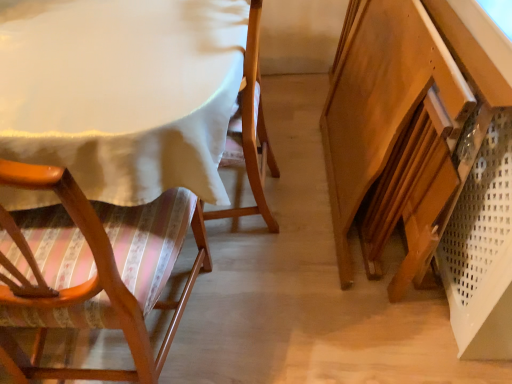
Image resolution: width=512 pixels, height=384 pixels. Describe the element at coordinates (91, 270) in the screenshot. I see `wooden chair with striped cushion at left` at that location.

Where is `white fabric table at upper left`? The width and height of the screenshot is (512, 384). white fabric table at upper left is located at coordinates (123, 93).

Considering the relative sizes of wooden vanity at lower right and wooden chair with striped cushion at left in the image provided, is wooden vanity at lower right thinner than wooden chair with striped cushion at left?

Yes.

Can you confirm if wooden vanity at lower right is bigger than wooden chair with striped cushion at left?

Incorrect, wooden vanity at lower right is not larger than wooden chair with striped cushion at left.

Is wooden vanity at lower right positioned with its back to wooden chair with striped cushion at left?

That's not correct — wooden vanity at lower right is not looking away from wooden chair with striped cushion at left.

How distant is wooden vanity at lower right from wooden chair with striped cushion at left?

A distance of 29.91 inches exists between wooden vanity at lower right and wooden chair with striped cushion at left.

Is white fabric table at upper left looking in the opposite direction of wooden chair with striped cushion at left?

That's not correct — white fabric table at upper left is not looking away from wooden chair with striped cushion at left.

Which object is further away from the camera taking this photo, white fabric table at upper left or wooden chair with striped cushion at left?

white fabric table at upper left is behind.

From a real-world perspective, is white fabric table at upper left physically below wooden chair with striped cushion at left?

Correct, in the physical world, white fabric table at upper left is lower than wooden chair with striped cushion at left.

Does point (98, 9) lie in front of point (132, 273)?

That is False.

What's the angular difference between white fabric table at upper left and wooden vanity at lower right's facing directions?

The facing directions of white fabric table at upper left and wooden vanity at lower right are 178 degrees apart.

From a real-world perspective, is white fabric table at upper left positioned above or below wooden vanity at lower right?

In terms of real-world spatial position, white fabric table at upper left is below wooden vanity at lower right.

Is white fabric table at upper left in front of or behind wooden vanity at lower right in the image?

white fabric table at upper left is behind wooden vanity at lower right.

In terms of height, does white fabric table at upper left look taller or shorter compared to wooden vanity at lower right?

Clearly, white fabric table at upper left is shorter compared to wooden vanity at lower right.

Which object is wider, wooden chair with striped cushion at left or white fabric table at upper left?

With larger width is white fabric table at upper left.

Based on the photo, is white fabric table at upper left at the back of wooden chair with striped cushion at left?

Yes.

Which is behind, point (140, 295) or point (147, 98)?

The point (140, 295) is farther.

Considering the relative sizes of wooden chair with striped cushion at left and white fabric table at upper left in the image provided, is wooden chair with striped cushion at left taller than white fabric table at upper left?

Correct, wooden chair with striped cushion at left is much taller as white fabric table at upper left.

Considering the relative sizes of wooden vanity at lower right and white fabric table at upper left in the image provided, is wooden vanity at lower right thinner than white fabric table at upper left?

Indeed, wooden vanity at lower right has a lesser width compared to white fabric table at upper left.

Which is in front, point (472, 139) or point (172, 63)?

The point (472, 139) is closer to the camera.

Which is more to the left, wooden vanity at lower right or white fabric table at upper left?

Positioned to the left is white fabric table at upper left.

Can you tell me how much wooden chair with striped cushion at left and wooden vanity at lower right differ in facing direction?

91.4 degrees separate the facing orientations of wooden chair with striped cushion at left and wooden vanity at lower right.

Looking at their sizes, would you say wooden chair with striped cushion at left is wider or thinner than wooden vanity at lower right?

Considering their sizes, wooden chair with striped cushion at left looks broader than wooden vanity at lower right.

Is point (86, 263) positioned in front of point (353, 214)?

Yes, it is in front of point (353, 214).

Does wooden chair with striped cushion at left have a larger size compared to wooden vanity at lower right?

Yes, wooden chair with striped cushion at left is bigger than wooden vanity at lower right.

Identify the location of chair that is above the wooden vanity at lower right (from a real-world perspective). (91, 270).

Identify the location of chair below the white fabric table at upper left (from the image's perspective). This screenshot has width=512, height=384. (91, 270).

Looking at the image, which one is located closer to wooden vanity at lower right, wooden chair with striped cushion at left or white fabric table at upper left?

white fabric table at upper left is positioned closer to the anchor wooden vanity at lower right.

From the image, which object appears to be nearer to wooden chair with striped cushion at left, white fabric table at upper left or wooden vanity at lower right?

Among the two, white fabric table at upper left is located nearer to wooden chair with striped cushion at left.

Looking at this image, from the image, which object appears to be farther from white fabric table at upper left, wooden vanity at lower right or wooden chair with striped cushion at left?

wooden vanity at lower right is positioned further to the anchor white fabric table at upper left.

Estimate the real-world distances between objects in this image. Which object is further from white fabric table at upper left, wooden chair with striped cushion at left or wooden vanity at lower right?

The object further to white fabric table at upper left is wooden vanity at lower right.

Based on their spatial positions, is wooden vanity at lower right or white fabric table at upper left closer to wooden chair with striped cushion at left?

white fabric table at upper left.

From the image, which object appears to be farther from wooden vanity at lower right, white fabric table at upper left or wooden chair with striped cushion at left?

The object further to wooden vanity at lower right is wooden chair with striped cushion at left.

The image size is (512, 384). What are the coordinates of `chair between white fabric table at upper left and wooden vanity at lower right in the horizontal direction` in the screenshot? It's located at (91, 270).